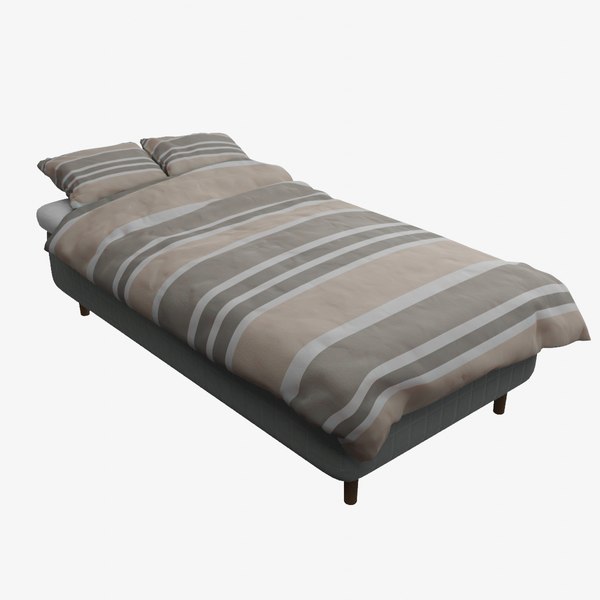
Identify the location of bed frame. Image resolution: width=600 pixels, height=600 pixels. (230, 400).